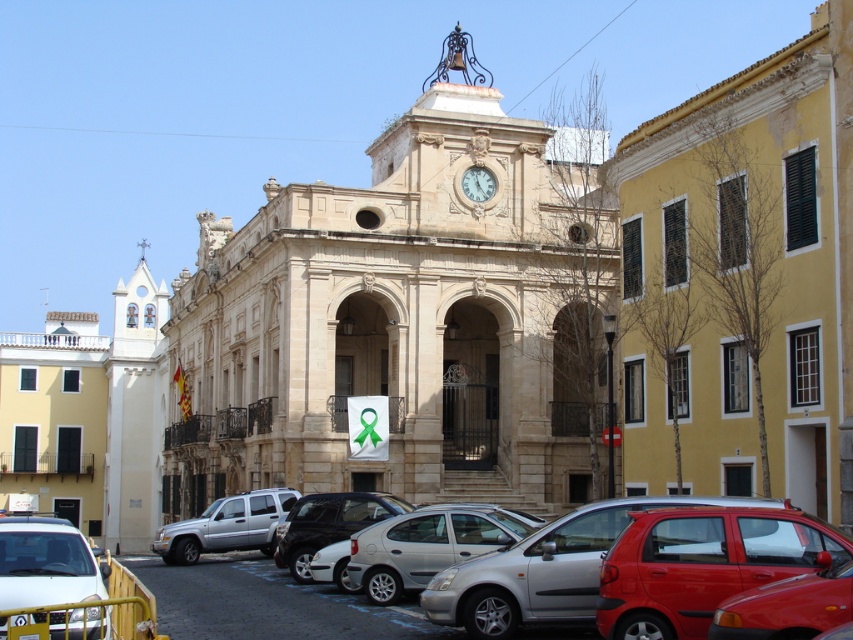
Does silver metallic hatchback at center appear over white marble clock at center?

Actually, silver metallic hatchback at center is below white marble clock at center.

Locate an element on the screen. This screenshot has height=640, width=853. silver metallic hatchback at center is located at coordinates (x=271, y=604).

Where is `silver metallic hatchback at center`? Image resolution: width=853 pixels, height=640 pixels. silver metallic hatchback at center is located at coordinates pyautogui.click(x=271, y=604).

Is yellow matte building at center to the left of silver metallic hatchback at center from the viewer's perspective?

Incorrect, yellow matte building at center is not on the left side of silver metallic hatchback at center.

Identify the location of yellow matte building at center. (744, 280).

Between point (846, 394) and point (245, 604), which one is positioned behind?

The point (846, 394) is behind.

I want to click on yellow matte building at center, so click(x=744, y=280).

Which is behind, point (642, 577) or point (167, 620)?

The point (167, 620) is more distant.

Who is more distant from viewer, (776, 536) or (252, 616)?

The point (252, 616) is more distant.

This screenshot has width=853, height=640. In order to click on shiny red car at lower right in this screenshot , I will do `click(701, 564)`.